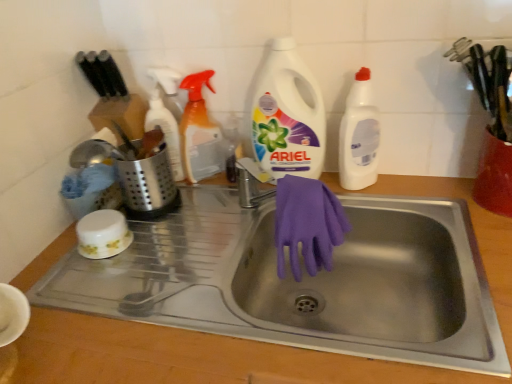
Where is `vacant area that lies to the right of white plastic bottle at upper right, the 1th cleaning product in the right-to-left sequence`? Image resolution: width=512 pixels, height=384 pixels. vacant area that lies to the right of white plastic bottle at upper right, the 1th cleaning product in the right-to-left sequence is located at coordinates (412, 186).